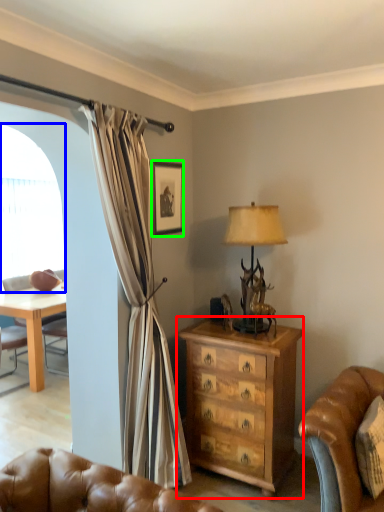
Question: Which is farther away from chest of drawers (highlighted by a red box)? window screen (highlighted by a blue box) or picture frame (highlighted by a green box)?

Choices:
 (A) window screen
 (B) picture frame

Answer: (A)